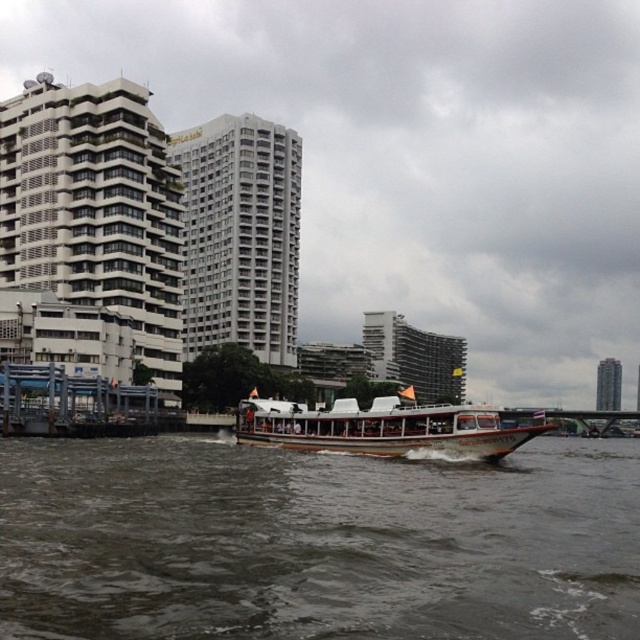
You are a boat operator who needs to navigate between the brown wooden boat at center and the wooden polished boat at center. The minimum safe distance for maneuvering your boat is 12 meters. Can you safely navigate between them?

The brown wooden boat at center is 11.91 meters from wooden polished boat at center. Since the minimum safe distance required is 12 meters, the distance is insufficient. Therefore, you cannot safely navigate between them.

You are standing at point A located at coordinates [316,541] in the riverside scene. What object is directly in front of you?

The brown wooden boat at center is located at point [316,541], so the object directly in front of you is the brown wooden boat at center.

You are a photographer planning to capture the two boats in the riverside scene. You need to ensure both the brown wooden boat at center and the wooden polished boat at center are fully visible in your shot. Which boat should you position closer to the edge of the frame to avoid cropping?

You should position the brown wooden boat at center closer to the edge of the frame since it is shorter than the wooden polished boat at center, allowing both to fit without cropping.